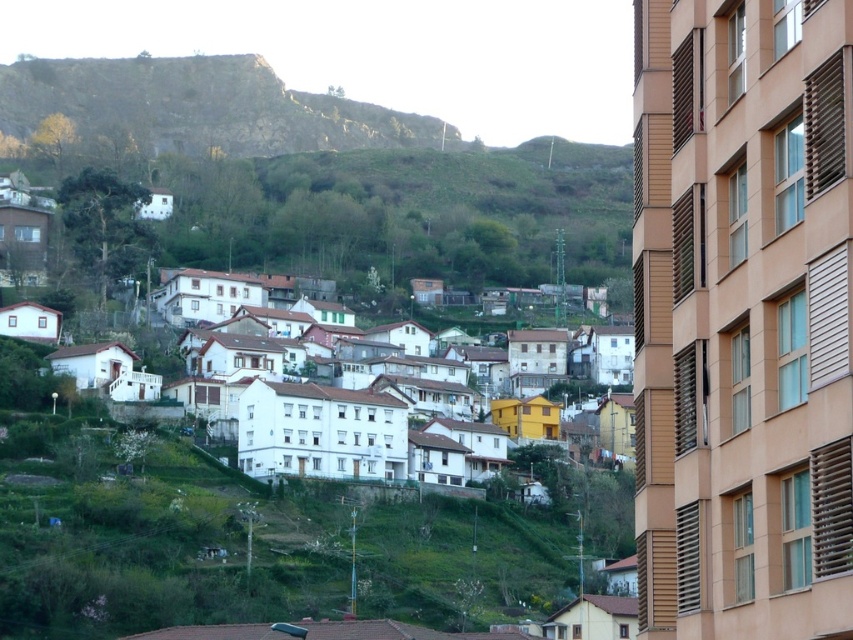
You are standing at the base of the hillside town and want to reach the point marked at coordinates point (219, 60). Given that you can walk at a speed of 3 feet per second, how many seconds will it take you to reach that point?

The point marked at coordinates point (219, 60) is 1017.37 feet away from you. At a walking speed of 3 feet per second, it would take approximately 339 seconds to reach that point.

You are standing at the base of the hillside town and want to reach the top. You notice two points marked on your map. The first point is located at coordinates point (82,106), and the second point is at point (465,388). According to the image, which point is closer to the top of the hill?

Point (82,106) is behind point (465,388), so it is closer to the top of the hill.

You are an architect planning to build a new structure in the town. You have to choose between placing it on the rustic stone hillside at upper left or among the white matte houses at center. Based on the spatial dimensions, which location offers more horizontal space for construction?

The rustic stone hillside at upper left offers more horizontal space for construction since its width is larger than that of the white matte houses at center.